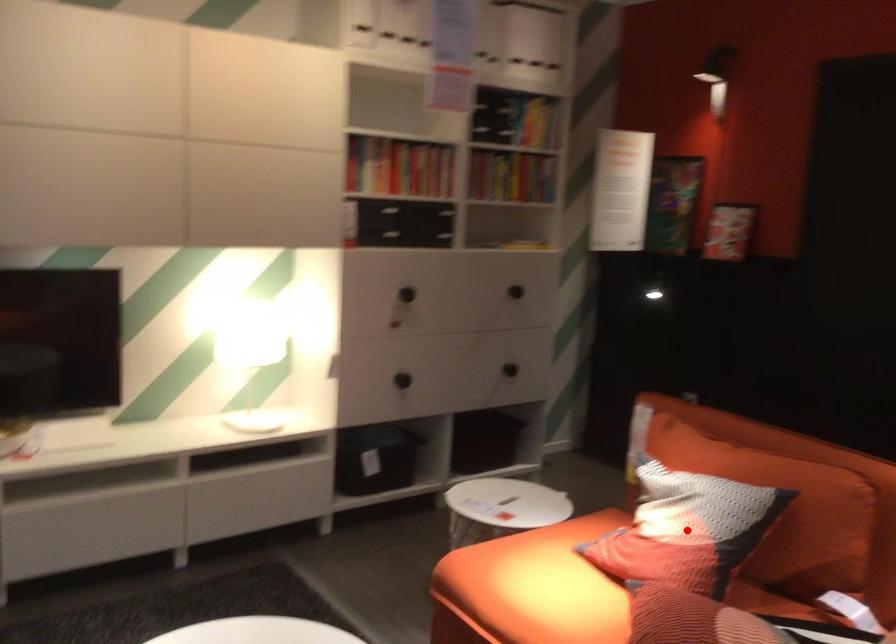
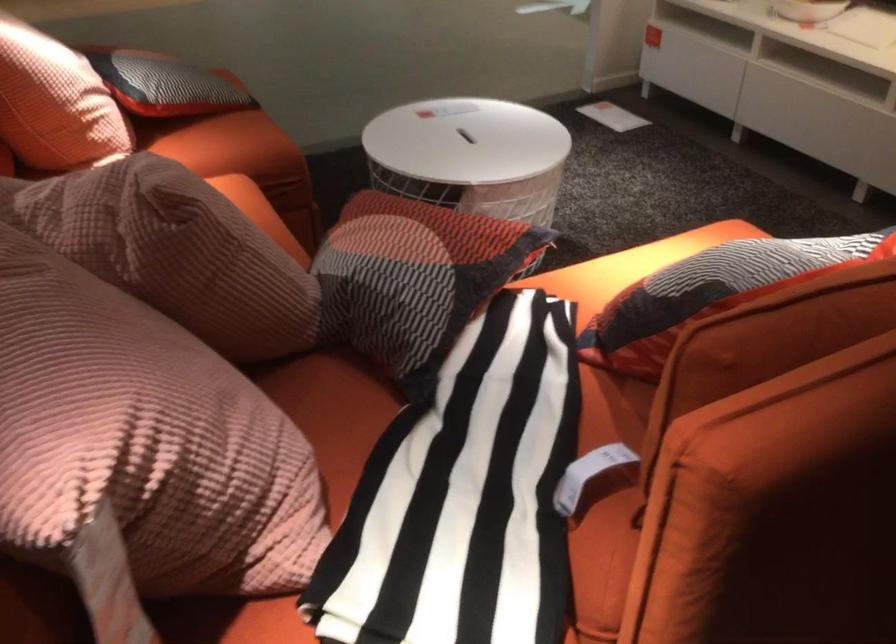
Question: I am providing you with two images of the same scene from different viewpoints. A red point is marked on the first image. Is the red point's position out of view in image 2?

Choices:
 (A) Yes
 (B) No

Answer: (A)